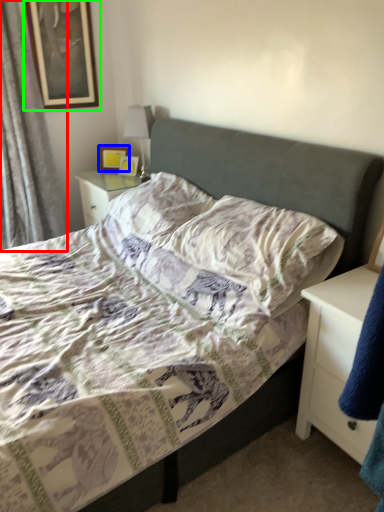
Question: Which object is positioned closest to curtain (highlighted by a red box)? Select from picture frame (highlighted by a blue box) and picture frame (highlighted by a green box).

Choices:
 (A) picture frame
 (B) picture frame

Answer: (B)